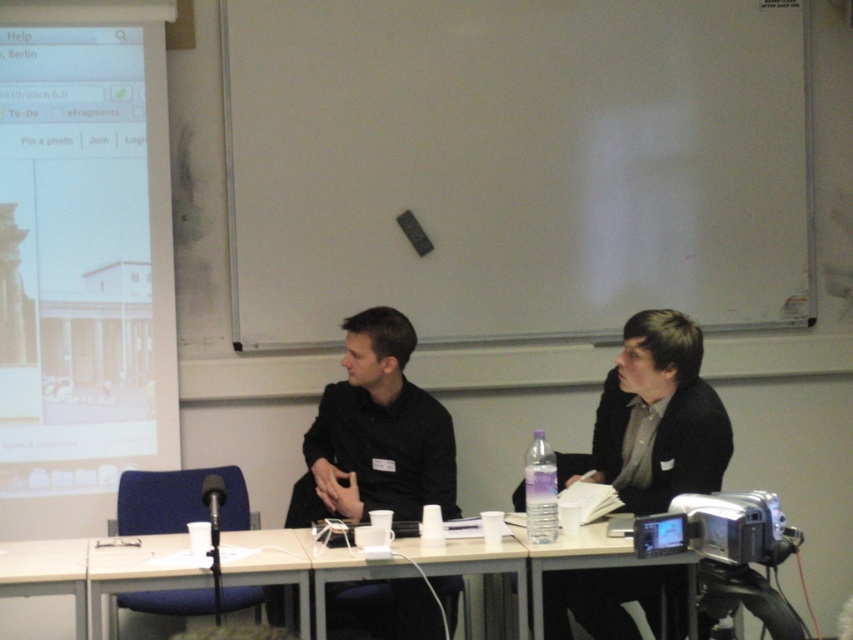
You are setting up a presentation and need to place a laptop between the white matte projector screen at upper left and the black matte shirt at center. Which object should you place the laptop closer to if you want it to be near the smaller object?

The white matte projector screen at upper left is smaller than the black matte shirt at center, so you should place the laptop closer to the white matte projector screen at upper left.

You are a photographer setting up for a video call. You see the white plastic table at center and the white plastic table at lower left. Which table should you adjust your camera angle to focus on if you want to capture the one that is higher?

The white plastic table at center is taller than the white plastic table at lower left, so you should adjust your camera angle to focus on the white plastic table at center.